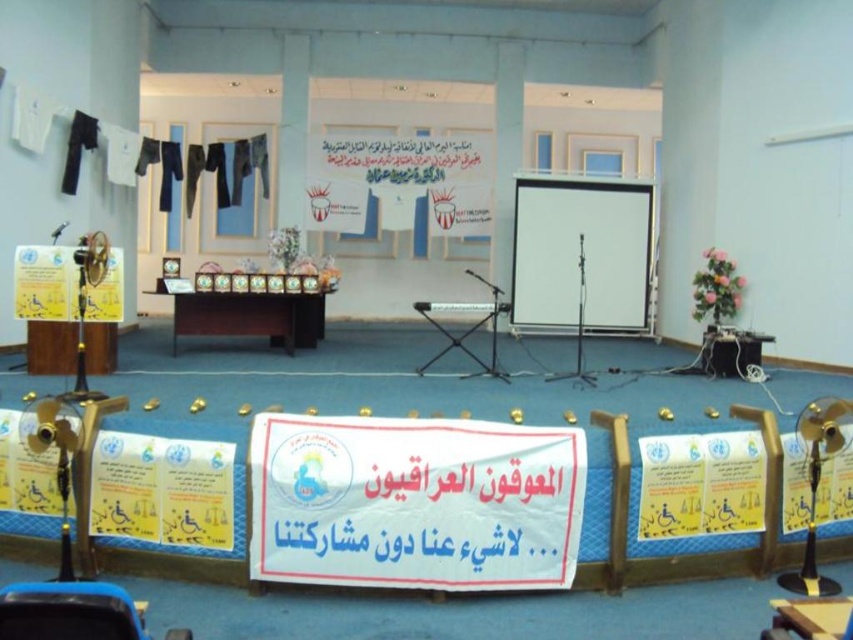
You are setting up a presentation in the described room. You need to place a 2.5 meter long table between the white matte projection screen at center and the microphone on the left. Will there be enough space between them to fit the table?

The distance between the white matte projection screen at center and the microphone is 10.68 meters. Since the table is only 2.5 meters long, there is sufficient space to place it between them.

You are standing in the conference hall and want to reach the point marked at coordinates (567, 298). If you walk directly towards it, how far will you have to walk?

The point marked at coordinates (567, 298) is 10.91 meters away from the viewer, so you will have to walk 10.91 meters to reach it.